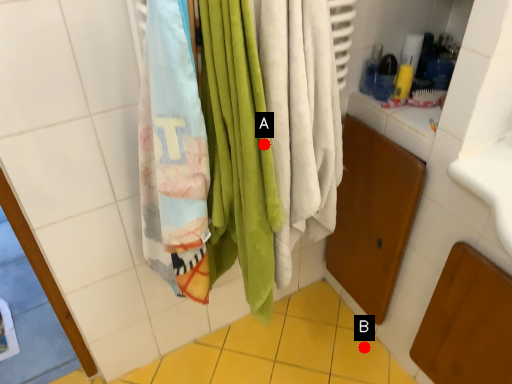
Question: Two points are circled on the image, labeled by A and B beside each circle. Which of the following is the closest to the observer?

Choices:
 (A) A is closer
 (B) B is closer

Answer: (A)